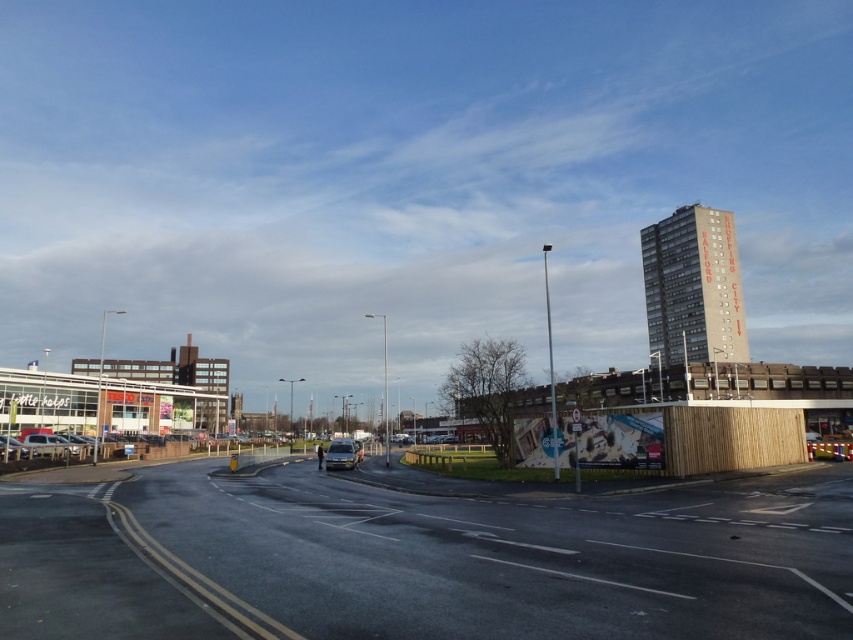
Is silver metallic van at center thinner than metallic silver car at lower left?

Incorrect, silver metallic van at center's width is not less than metallic silver car at lower left's.

Is silver metallic van at center to the left of metallic silver car at lower left from the viewer's perspective?

In fact, silver metallic van at center is to the right of metallic silver car at lower left.

Who is more distant from viewer, (338, 460) or (9, 452)?

The point (9, 452) is more distant.

This screenshot has width=853, height=640. I want to click on silver metallic van at center, so click(341, 452).

In the scene shown: Is concrete building at right wider than matte silver car at lower left?

Yes.

Is point (698, 257) farther from camera compared to point (53, 436)?

Yes.

You are a GUI agent. You are given a task and a screenshot of the screen. Output one action in this format:
    pyautogui.click(x=<x>, y=<y>)
    Task: Click on the concrete building at right
    
    Given the screenshot: What is the action you would take?
    point(693,285)

Is point (78, 448) closer to camera compared to point (12, 438)?

Yes.

Between point (61, 435) and point (16, 456), which one is positioned behind?

Positioned behind is point (61, 435).

This screenshot has height=640, width=853. In order to click on matte silver car at lower left in this screenshot , I will do `click(50, 442)`.